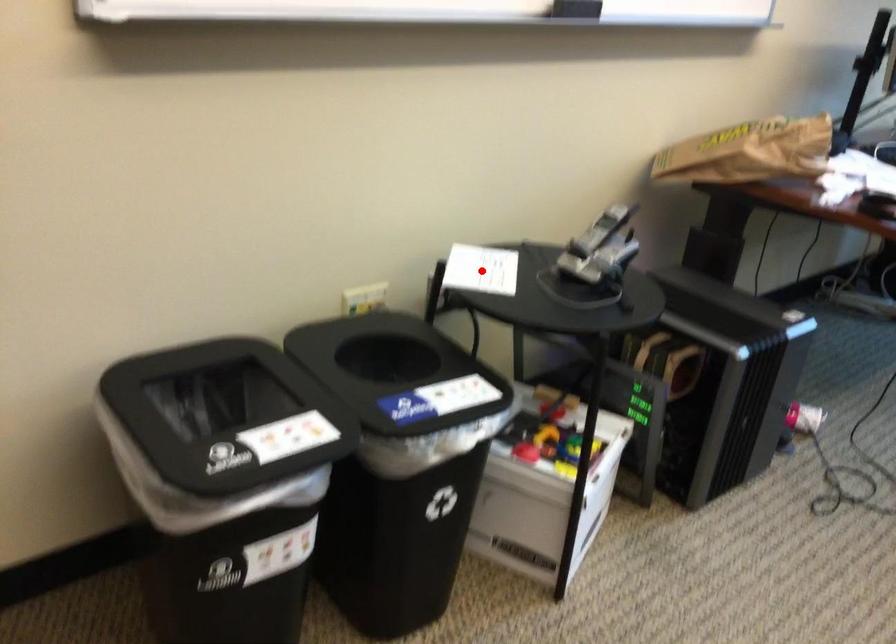
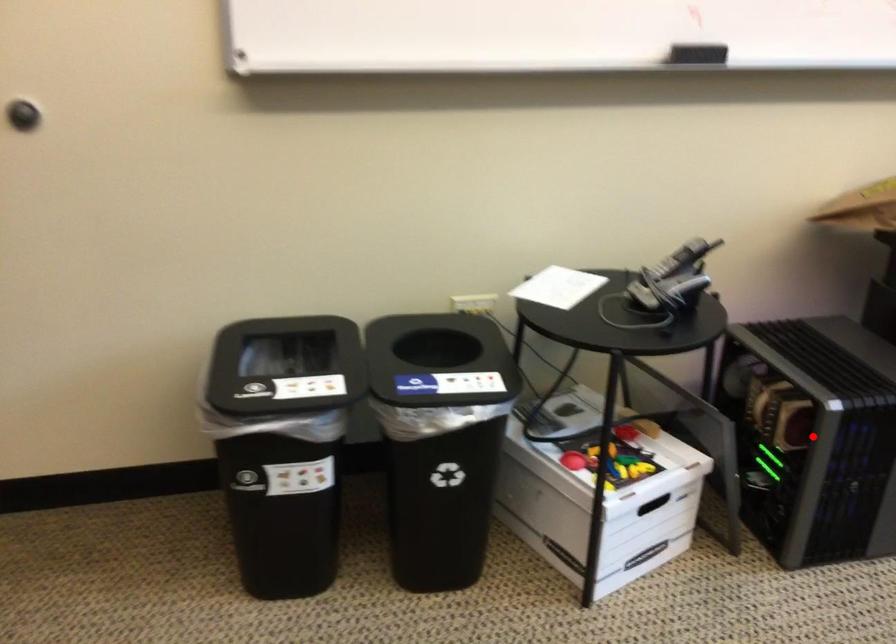
I am providing you with two images of the same scene from different viewpoints. A red point is marked on the first image and another point is marked on the second image. Is the marked point in image1 the same physical position as the marked point in image2?

No